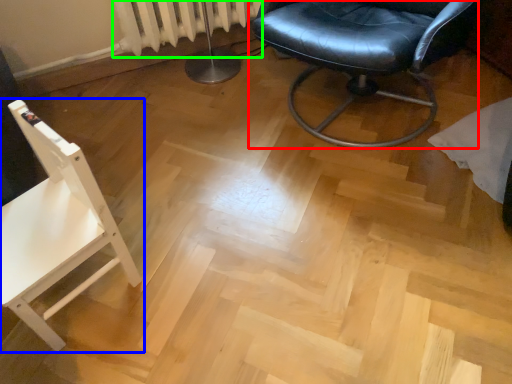
Question: Which is farther away from chair (highlighted by a red box)? chair (highlighted by a blue box) or radiator (highlighted by a green box)?

Choices:
 (A) chair
 (B) radiator

Answer: (A)